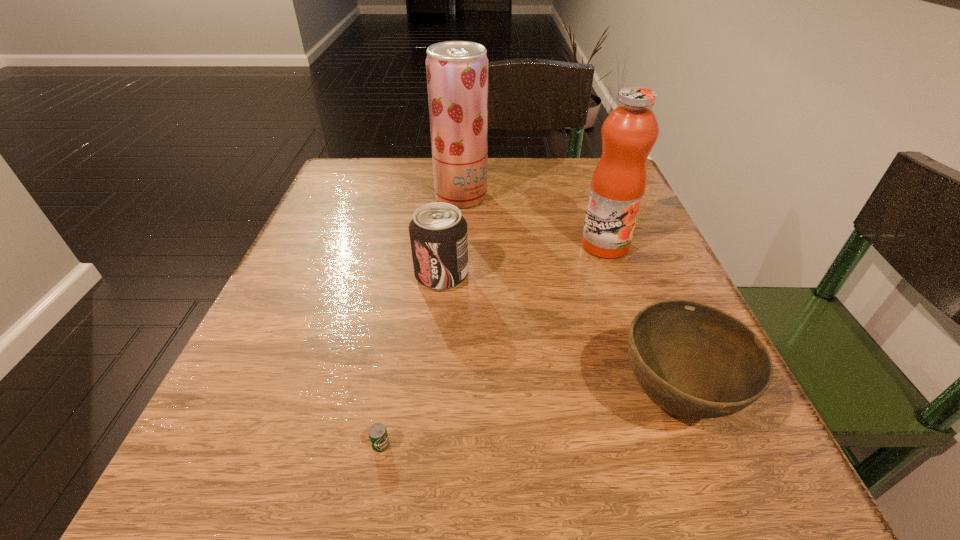
Identify which object is located as the nearest to the right fruit juice. Please provide its 2D coordinates. Your answer should be formatted as a tuple, i.e. [(x, y)], where the tuple contains the x and y coordinates of a point satisfying the conditions above.

[(457, 71)]

Identify which object is the third closest to the soda can. Please provide its 2D coordinates. Your answer should be formatted as a tuple, i.e. [(x, y)], where the tuple contains the x and y coordinates of a point satisfying the conditions above.

[(378, 435)]

This screenshot has height=540, width=960. Identify the location of blank area in the image that satisfies the following two spatial constraints: 1. on the front label of the nearer fruit juice; 2. on the left side of the bowl. (659, 398).